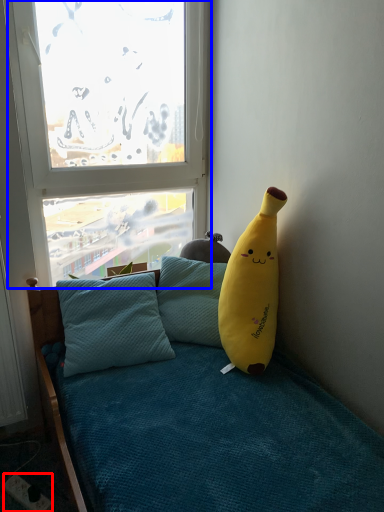
Question: Which object appears closest to the camera in this image, power outlet (highlighted by a red box) or window (highlighted by a blue box)?

Choices:
 (A) power outlet
 (B) window

Answer: (A)